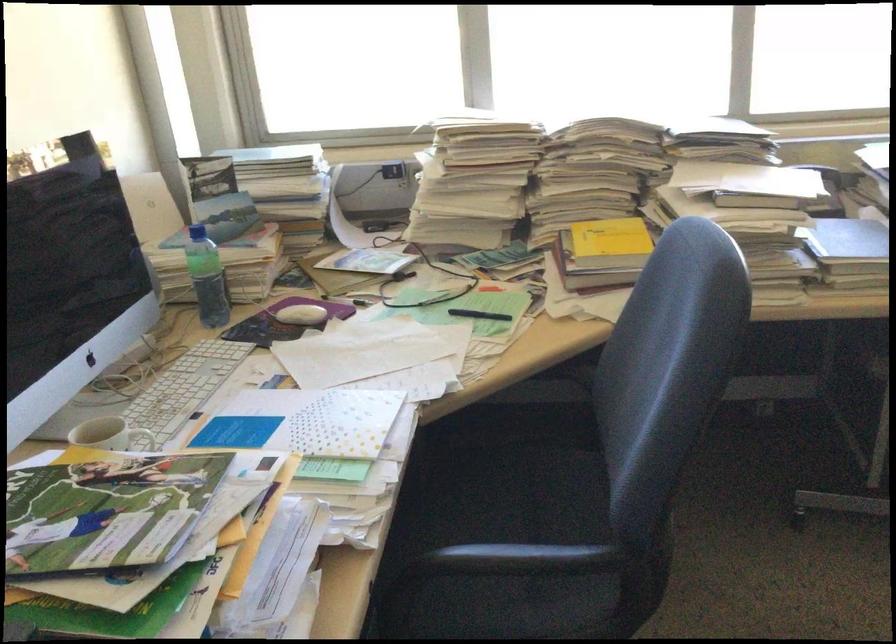
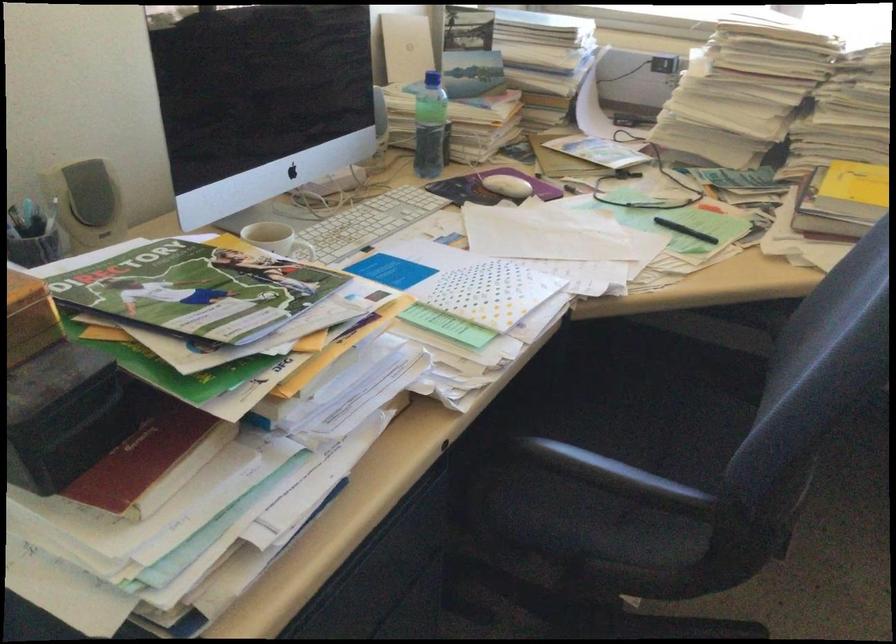
Find the pixel in the second image that matches point 478,315 in the first image.

(684, 230)